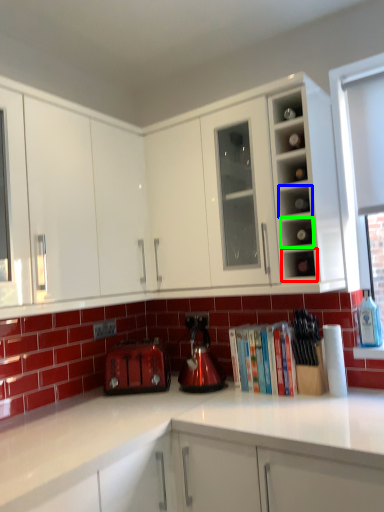
Question: Which object is the farthest from shelf (highlighted by a red box)? Choose among these: shelf (highlighted by a blue box) or shelf (highlighted by a green box).

Choices:
 (A) shelf
 (B) shelf

Answer: (A)